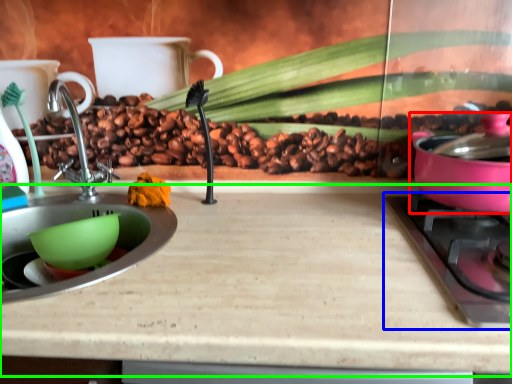
Question: Considering the real-world distances, which object is farthest from kitchen appliance (highlighted by a red box)? gas stove (highlighted by a blue box) or counter top (highlighted by a green box)?

Choices:
 (A) gas stove
 (B) counter top

Answer: (B)